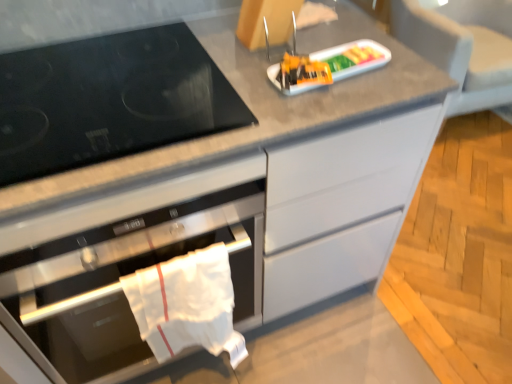
Identify the location of vacant space behind plastic tray at center. (328, 29).